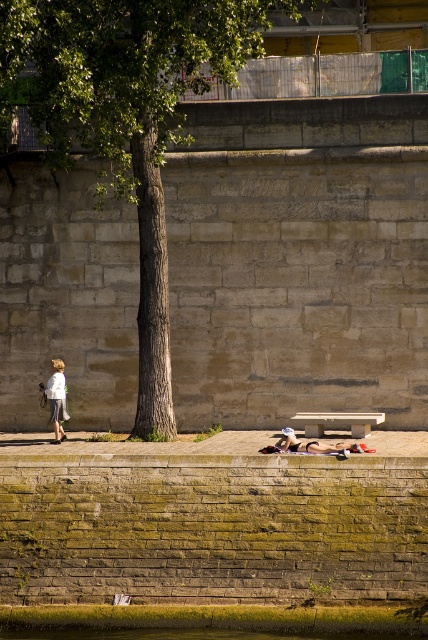
Does stone bench at lower center have a lesser width compared to white cotton shirt at left?

Incorrect, stone bench at lower center's width is not less than white cotton shirt at left's.

Is stone bench at lower center behind white cotton shirt at left?

No, stone bench at lower center is in front of white cotton shirt at left.

At what (x,y) coordinates should I click in order to perform the action: click on stone bench at lower center. Please return your answer as a coordinate pair (x, y). Looking at the image, I should click on (338, 420).

The image size is (428, 640). What are the coordinates of `stone bench at lower center` in the screenshot? It's located at (338, 420).

Is the position of stone bench at lower center more distant than that of tan leather sandals at lower center?

Yes, it is behind tan leather sandals at lower center.

Which is in front, point (321, 420) or point (359, 451)?

Point (359, 451) is more forward.

Who is more distant from viewer, (315, 428) or (342, 449)?

The point (315, 428) is behind.

Identify the location of stone bench at lower center. (338, 420).

Between point (115, 93) and point (41, 387), which one is positioned behind?

Positioned behind is point (41, 387).

Does green leafy tree at center have a lesser width compared to white cotton shirt at left?

No, green leafy tree at center is not thinner than white cotton shirt at left.

Does point (181, 44) lie behind point (62, 417)?

No, (181, 44) is in front of (62, 417).

Locate an element on the screen. This screenshot has height=640, width=428. green leafy tree at center is located at coordinates (127, 118).